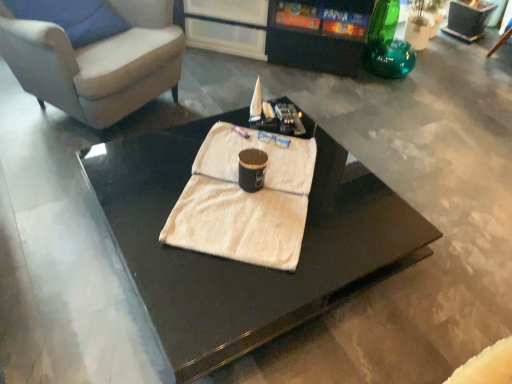
This screenshot has width=512, height=384. Find the location of `black glossy entertainment center at upper center`. black glossy entertainment center at upper center is located at coordinates (298, 30).

This screenshot has height=384, width=512. What are the coordinates of `black glossy entertainment center at upper center` in the screenshot? It's located at (298, 30).

From the image's perspective, would you say white textured towel at center is shown under black glossy entertainment center at upper center?

Indeed, from the image's perspective, white textured towel at center is shown beneath black glossy entertainment center at upper center.

Who is bigger, white textured towel at center or black glossy entertainment center at upper center?

Result: black glossy entertainment center at upper center is bigger.

Based on the photo, in terms of height, does white textured towel at center look taller or shorter compared to black glossy entertainment center at upper center?

Considering their sizes, white textured towel at center has less height than black glossy entertainment center at upper center.

Considering the relative sizes of white textured towel at center and black glossy entertainment center at upper center in the image provided, is white textured towel at center thinner than black glossy entertainment center at upper center?

Indeed, white textured towel at center has a lesser width compared to black glossy entertainment center at upper center.

Is black glossy coffee table at center facing away from white textured towel at center?

That's not correct — black glossy coffee table at center is not looking away from white textured towel at center.

In the scene shown: Considering the sizes of objects black glossy coffee table at center and white textured towel at center in the image provided, who is thinner, black glossy coffee table at center or white textured towel at center?

Thinner between the two is white textured towel at center.

Based on the photo, is the position of black glossy coffee table at center more distant than that of white textured towel at center?

No, it is in front of white textured towel at center.

From a real-world perspective, is black glossy coffee table at center located higher than white textured towel at center?

No, from a real-world perspective, black glossy coffee table at center is not over white textured towel at center

Where is `coffee table that appears on the left of black glossy entertainment center at upper center`? coffee table that appears on the left of black glossy entertainment center at upper center is located at coordinates (245, 263).

Measure the distance between black glossy coffee table at center and black glossy entertainment center at upper center.

They are 4.68 feet apart.

Is black glossy coffee table at center at the left side of black glossy entertainment center at upper center?

Yes, black glossy coffee table at center is to the left of black glossy entertainment center at upper center.

Could you tell me if white textured towel at center is turned towards black glossy coffee table at center?

No, white textured towel at center is not turned towards black glossy coffee table at center.

This screenshot has width=512, height=384. I want to click on coffee table that appears in front of the white textured towel at center, so click(245, 263).

Choose the correct answer: Is white textured towel at center inside black glossy coffee table at center or outside it?

white textured towel at center is inside black glossy coffee table at center.

Is white textured towel at center bigger than black glossy coffee table at center?

No.

Is suede-like beige armchair at upper left oriented away from white textured towel at center?

No.

Could white textured towel at center be considered to be inside suede-like beige armchair at upper left?

That's incorrect, white textured towel at center is not inside suede-like beige armchair at upper left.

Does suede-like beige armchair at upper left have a greater height compared to white textured towel at center?

Yes, suede-like beige armchair at upper left is taller than white textured towel at center.

Looking at this image, is suede-like beige armchair at upper left with white textured towel at center?

suede-like beige armchair at upper left and white textured towel at center are not in contact.

Considering the sizes of objects black glossy entertainment center at upper center and black glossy coffee table at center in the image provided, who is shorter, black glossy entertainment center at upper center or black glossy coffee table at center?

With less height is black glossy coffee table at center.

Is black glossy entertainment center at upper center outside of black glossy coffee table at center?

Yes, black glossy entertainment center at upper center is outside of black glossy coffee table at center.

Is black glossy entertainment center at upper center closer to camera compared to black glossy coffee table at center?

That is False.

Between suede-like beige armchair at upper left and black glossy coffee table at center, which one has larger width?

black glossy coffee table at center.

From a real-world perspective, who is located higher, suede-like beige armchair at upper left or black glossy coffee table at center?

suede-like beige armchair at upper left is physically above.

How different are the orientations of suede-like beige armchair at upper left and black glossy coffee table at center in degrees?

They differ by 27.6 degrees in their facing directions.

Which of these two, suede-like beige armchair at upper left or black glossy coffee table at center, is bigger?

With larger size is suede-like beige armchair at upper left.

In order to click on entertainment center that is on the right side of white textured towel at center in this screenshot , I will do `click(298, 30)`.

At what (x,y) coordinates should I click in order to perform the action: click on coffee table beneath the white textured towel at center (from a real-world perspective). Please return your answer as a coordinate pair (x, y). Image resolution: width=512 pixels, height=384 pixels. Looking at the image, I should click on tap(245, 263).

Looking at the image, which one is located closer to black glossy entertainment center at upper center, suede-like beige armchair at upper left or black glossy coffee table at center?

suede-like beige armchair at upper left.

Which object lies further to the anchor point suede-like beige armchair at upper left, black glossy entertainment center at upper center or black glossy coffee table at center?

black glossy entertainment center at upper center is positioned further to the anchor suede-like beige armchair at upper left.

Looking at the image, which one is located closer to black glossy coffee table at center, black glossy entertainment center at upper center or white textured towel at center?

The object closer to black glossy coffee table at center is white textured towel at center.

Based on their spatial positions, is black glossy coffee table at center or white textured towel at center further from suede-like beige armchair at upper left?

white textured towel at center is positioned further to the anchor suede-like beige armchair at upper left.

Looking at this image, estimate the real-world distances between objects in this image. Which object is further from black glossy entertainment center at upper center, black glossy coffee table at center or white textured towel at center?

Based on the image, white textured towel at center appears to be further to black glossy entertainment center at upper center.

Looking at the image, which one is located further to black glossy entertainment center at upper center, white textured towel at center or black glossy coffee table at center?

white textured towel at center is positioned further to the anchor black glossy entertainment center at upper center.

From the image, which object appears to be nearer to black glossy coffee table at center, suede-like beige armchair at upper left or black glossy entertainment center at upper center?

Based on the image, suede-like beige armchair at upper left appears to be nearer to black glossy coffee table at center.

When comparing their distances from white textured towel at center, does suede-like beige armchair at upper left or black glossy coffee table at center seem further?

suede-like beige armchair at upper left is further to white textured towel at center.

Locate an element on the screen. The width and height of the screenshot is (512, 384). blanket between black glossy entertainment center at upper center and black glossy coffee table at center in the up-down direction is located at coordinates (245, 200).

Identify the location of chair located between black glossy coffee table at center and black glossy entertainment center at upper center in the depth direction. (97, 62).

Find the location of `blanket between suede-like beige armchair at upper left and black glossy coffee table at center in the vertical direction`. blanket between suede-like beige armchair at upper left and black glossy coffee table at center in the vertical direction is located at coordinates (245, 200).

Identify the location of chair between black glossy entertainment center at upper center and white textured towel at center vertically. The height and width of the screenshot is (384, 512). (97, 62).